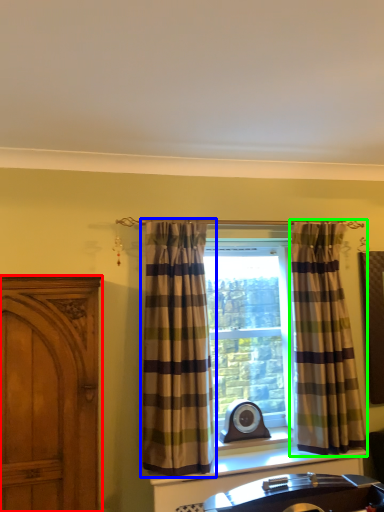
Question: Considering the real-world distances, which object is farthest from cabinetry (highlighted by a red box)? curtain (highlighted by a blue box) or curtain (highlighted by a green box)?

Choices:
 (A) curtain
 (B) curtain

Answer: (B)